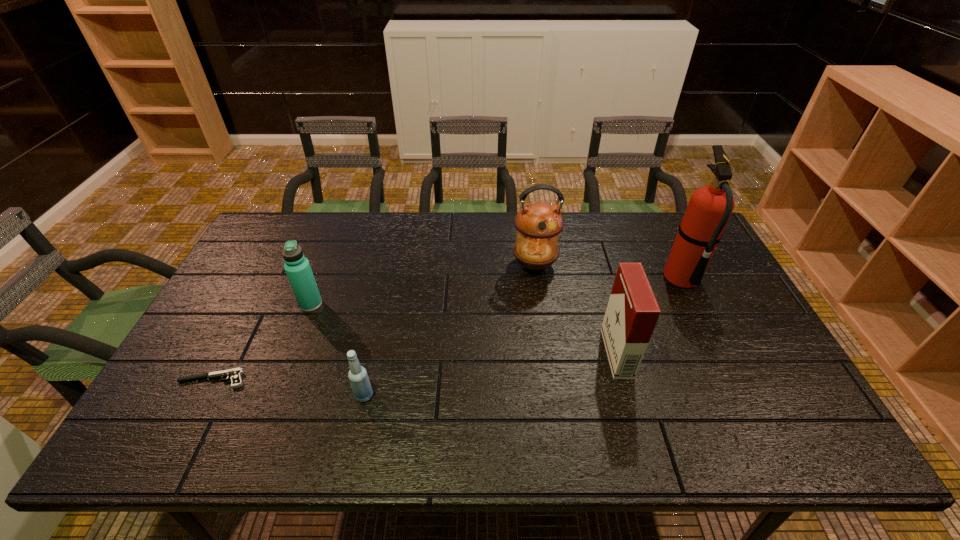
The width and height of the screenshot is (960, 540). I want to click on object present at the left edge, so click(x=235, y=374).

Locate an element on the screen. object positioned at the right edge is located at coordinates (709, 208).

Locate an element on the screen. vacant space at the far edge of the desktop is located at coordinates (376, 214).

Locate an element on the screen. Image resolution: width=960 pixels, height=540 pixels. vacant space at the near edge is located at coordinates (732, 419).

I want to click on vacant space at the left edge, so [269, 296].

Image resolution: width=960 pixels, height=540 pixels. I want to click on free space at the far right corner of the desktop, so click(664, 254).

Identify the location of free area in between the fifth object from right to left and the rightmost object. Image resolution: width=960 pixels, height=540 pixels. (496, 292).

You are a GUI agent. You are given a task and a screenshot of the screen. Output one action in this format:
    pyautogui.click(x=<x>, y=<y>)
    Task: Click on the vacant area that lies between the third object from right to left and the pistol
    The image size is (960, 540).
    Given the screenshot: What is the action you would take?
    pyautogui.click(x=373, y=322)

I want to click on vacant area that lies between the cigarette_case and the third object from right to left, so (576, 309).

You are a GUI agent. You are given a task and a screenshot of the screen. Output one action in this format:
    pyautogui.click(x=<x>, y=<y>)
    Task: Click on the free spot between the fifth tallest object and the cigarette_case
    This screenshot has height=540, width=960.
    Given the screenshot: What is the action you would take?
    pyautogui.click(x=491, y=374)